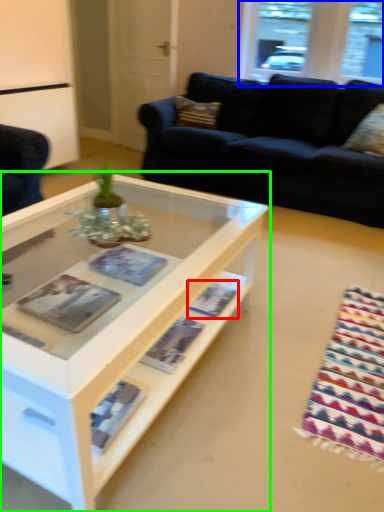
Question: Which object is positioned farthest from magazine (highlighted by a red box)? Select from window (highlighted by a blue box) and coffee table (highlighted by a green box).

Choices:
 (A) window
 (B) coffee table

Answer: (A)